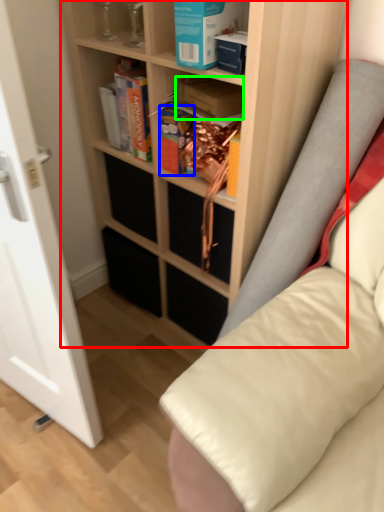
Question: Based on their relative distances, which object is farther from shelf (highlighted by a red box)? Choose from paperback book (highlighted by a blue box) and paperback book (highlighted by a green box).

Choices:
 (A) paperback book
 (B) paperback book

Answer: (B)